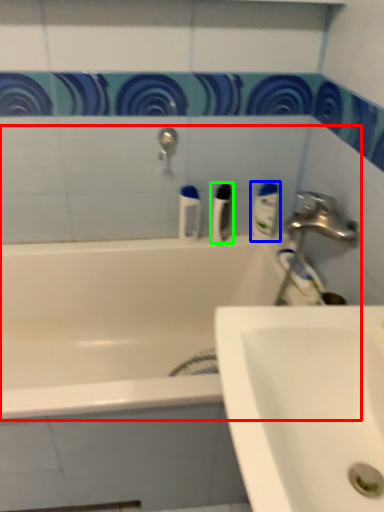
Question: Which object is the farthest from bathtub (highlighted by a red box)? Choose among these: mouthwash (highlighted by a blue box) or toiletry (highlighted by a green box).

Choices:
 (A) mouthwash
 (B) toiletry

Answer: (A)